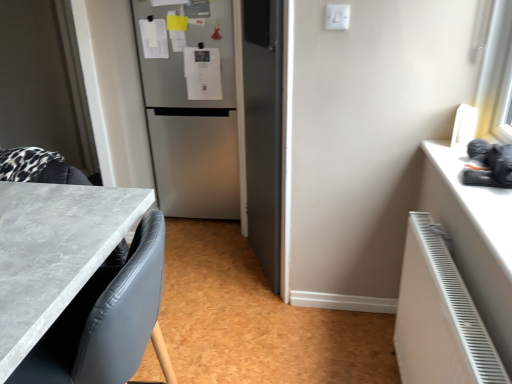
Question: Relative to white matte counter top at right, is gray marble countertop at lower left in front or behind?

Choices:
 (A) behind
 (B) front

Answer: (B)

Question: Does point (133, 198) appear closer or farther from the camera than point (456, 187)?

Choices:
 (A) closer
 (B) farther

Answer: (A)

Question: Considering the real-world distances, which object is farthest from the gray marble countertop at lower left?

Choices:
 (A) white matte radiator at lower right
 (B) stainless steel refrigerator at center
 (C) white matte counter top at right

Answer: (B)

Question: Which of these objects is positioned farthest from the white matte counter top at right?

Choices:
 (A) gray marble countertop at lower left
 (B) stainless steel refrigerator at center
 (C) white matte radiator at lower right

Answer: (B)